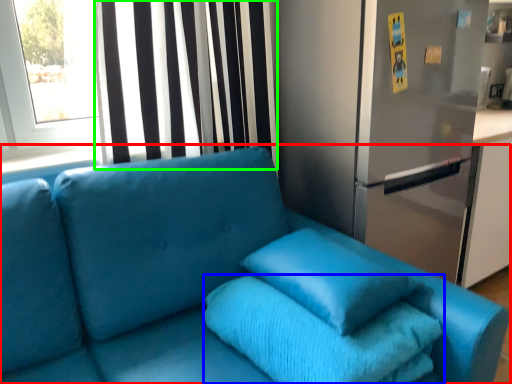
Question: Which is nearer to the studio couch (highlighted by a red box)? bath towel (highlighted by a blue box) or curtain (highlighted by a green box).

Choices:
 (A) bath towel
 (B) curtain

Answer: (A)